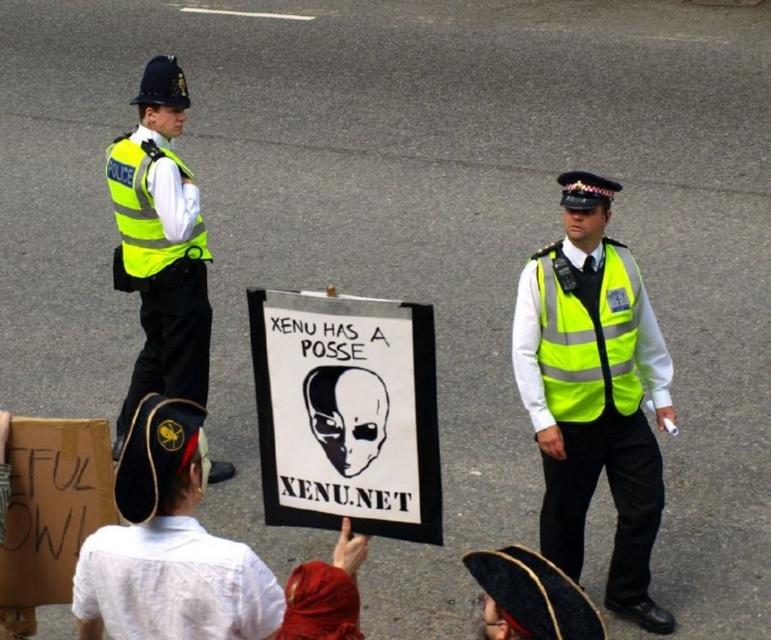
Question: Can you confirm if high-visibility vest at center is positioned above high-visibility yellow vest at left?

Choices:
 (A) no
 (B) yes

Answer: (A)

Question: Which point is closer to the camera?

Choices:
 (A) high-visibility vest at center
 (B) high-visibility yellow vest at left

Answer: (A)

Question: Observing the image, what is the correct spatial positioning of high-visibility vest at center in reference to high-visibility yellow vest at left?

Choices:
 (A) left
 (B) right

Answer: (B)

Question: From the image, what is the correct spatial relationship of high-visibility vest at center in relation to high-visibility yellow vest at left?

Choices:
 (A) right
 (B) left

Answer: (A)

Question: Which object appears farthest from the camera in this image?

Choices:
 (A) high-visibility vest at center
 (B) high-visibility yellow vest at left

Answer: (B)